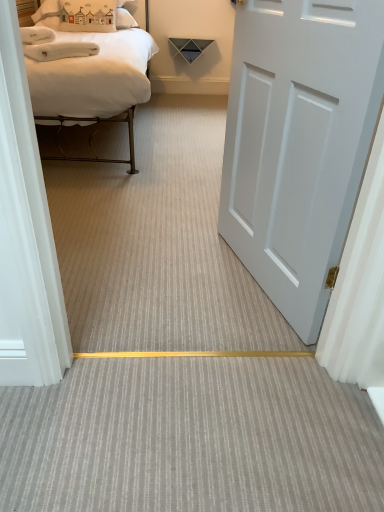
Locate an element on the screen. The height and width of the screenshot is (512, 384). white matte door at right is located at coordinates (298, 143).

Where is `white matte bed at upper left`? This screenshot has height=512, width=384. white matte bed at upper left is located at coordinates (91, 76).

The height and width of the screenshot is (512, 384). In order to click on plain lying behind the white matte door at right in this screenshot , I will do `click(191, 439)`.

From the image's perspective, is gray textured carpet at center located above or below white matte door at right?

Clearly, from the image's perspective, gray textured carpet at center is below white matte door at right.

Looking at this image, who is bigger, gray textured carpet at center or white matte door at right?

With larger size is white matte door at right.

Considering the sizes of objects white fabric pillow at upper left and white matte door at right in the image provided, who is bigger, white fabric pillow at upper left or white matte door at right?

white matte door at right is bigger.

Is white fabric pillow at upper left not close to white matte door at right?

Yes, white fabric pillow at upper left and white matte door at right are located far from each other.

Considering the relative positions of white fabric pillow at upper left and white matte door at right in the image provided, is white fabric pillow at upper left behind white matte door at right?

Yes, white fabric pillow at upper left is behind white matte door at right.

From the image's perspective, which is above, white fabric pillow at upper left or gray textured carpet at center?

white fabric pillow at upper left is shown above in the image.

Considering the positions of objects white fabric pillow at upper left and gray textured carpet at center in the image provided, who is more to the left, white fabric pillow at upper left or gray textured carpet at center?

Positioned to the left is white fabric pillow at upper left.

Could you tell me if white fabric pillow at upper left is turned towards gray textured carpet at center?

No, white fabric pillow at upper left is not aimed at gray textured carpet at center.

Is white fabric pillow at upper left next to gray textured carpet at center and touching it?

No, white fabric pillow at upper left is not in contact with gray textured carpet at center.

Can you tell me how much gray textured carpet at center and white fabric pillow at upper left differ in facing direction?

The facing directions of gray textured carpet at center and white fabric pillow at upper left are 180 degrees apart.

From the image's perspective, does gray textured carpet at center appear higher than white fabric pillow at upper left?

Actually, gray textured carpet at center appears below white fabric pillow at upper left in the image.

Which object is positioned more to the right, gray textured carpet at center or white fabric pillow at upper left?

gray textured carpet at center is more to the right.

Considering the sizes of objects gray textured carpet at center and white fabric pillow at upper left in the image provided, who is smaller, gray textured carpet at center or white fabric pillow at upper left?

gray textured carpet at center is smaller.

From the image's perspective, is white matte door at right above or below gray textured carpet at center?

white matte door at right is situated higher than gray textured carpet at center in the image.

Would you consider white matte door at right to be distant from gray textured carpet at center?

white matte door at right is actually quite close to gray textured carpet at center.

Does point (282, 174) come behind point (5, 500)?

Yes.

Identify the location of plain below the white matte bed at upper left (from the image's perspective). This screenshot has width=384, height=512. (191, 439).

Looking at this image, can you confirm if white matte bed at upper left is positioned to the right of gray textured carpet at center?

Incorrect, white matte bed at upper left is not on the right side of gray textured carpet at center.

From a real-world perspective, which object stands above the other?

white matte bed at upper left.

From the image's perspective, is white matte bed at upper left beneath gray textured carpet at center?

No.

Is the position of white matte bed at upper left more distant than that of white fabric pillow at upper left?

No, the depth of white matte bed at upper left is less than that of white fabric pillow at upper left.

Considering the positions of point (31, 82) and point (144, 3), is point (31, 82) closer or farther from the camera than point (144, 3)?

Point (31, 82) appears to be closer to the viewer than point (144, 3).

Which of these two, white matte bed at upper left or white fabric pillow at upper left, is wider?

white matte bed at upper left is wider.

Which object is positioned more to the left, white matte bed at upper left or white fabric pillow at upper left?

white fabric pillow at upper left.

Locate an element on the screen. door above the gray textured carpet at center (from the image's perspective) is located at coordinates (298, 143).

At what (x,y) coordinates should I click in order to perform the action: click on pillow that appears above the white matte door at right (from a real-world perspective). Please return your answer as a coordinate pair (x, y). Image resolution: width=384 pixels, height=512 pixels. Looking at the image, I should click on (137, 9).

From the image, which object appears to be farther from gray textured carpet at center, white matte door at right or white matte bed at upper left?

The object further to gray textured carpet at center is white matte bed at upper left.

Based on their spatial positions, is gray textured carpet at center or white fabric pillow at upper left closer to white matte door at right?

gray textured carpet at center.

Based on their spatial positions, is white matte bed at upper left or white matte door at right further from white fabric pillow at upper left?

white matte door at right.

Considering their positions, is gray textured carpet at center positioned further to white matte bed at upper left than white matte door at right?

gray textured carpet at center is positioned further to the anchor white matte bed at upper left.

When comparing their distances from gray textured carpet at center, does white fabric pillow at upper left or white matte bed at upper left seem further?

Among the two, white fabric pillow at upper left is located further to gray textured carpet at center.

When comparing their distances from white fabric pillow at upper left, does white matte bed at upper left or gray textured carpet at center seem further?

gray textured carpet at center is positioned further to the anchor white fabric pillow at upper left.

Looking at the image, which one is located further to gray textured carpet at center, white matte door at right or white fabric pillow at upper left?

white fabric pillow at upper left is further to gray textured carpet at center.

Estimate the real-world distances between objects in this image. Which object is closer to white matte bed at upper left, white fabric pillow at upper left or white matte door at right?

The object closer to white matte bed at upper left is white matte door at right.

Locate an element on the screen. The image size is (384, 512). bed between white matte door at right and white fabric pillow at upper left from front to back is located at coordinates [91, 76].

Locate an element on the screen. The image size is (384, 512). plain located between white matte door at right and white fabric pillow at upper left in the depth direction is located at coordinates (191, 439).

Find the location of `bed between white fabric pillow at upper left and gray textured carpet at center from top to bottom`. bed between white fabric pillow at upper left and gray textured carpet at center from top to bottom is located at coordinates (91, 76).

Identify the location of door between white matte bed at upper left and gray textured carpet at center vertically. The width and height of the screenshot is (384, 512). (298, 143).